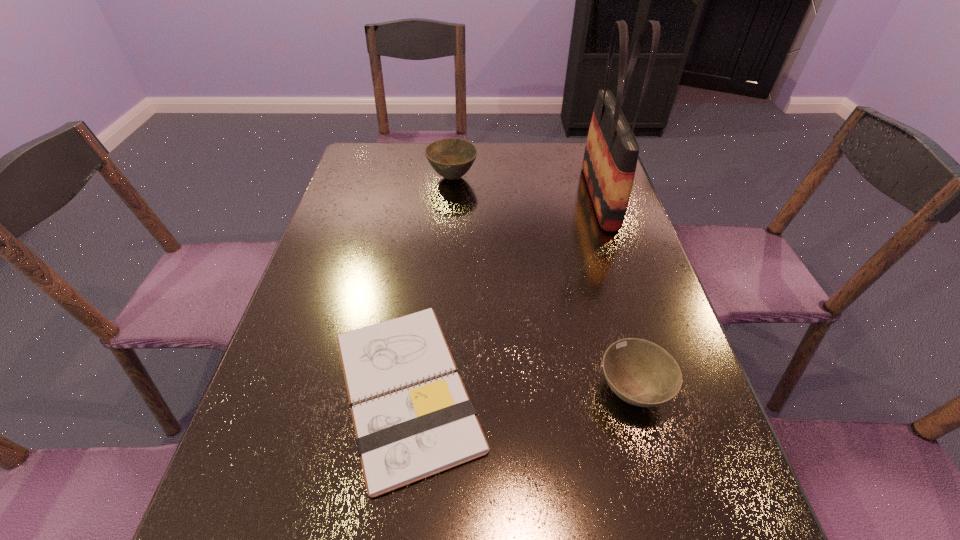
Find the location of a particular element. unoccupied position between the farther bowl and the notepad is located at coordinates (429, 284).

I want to click on vacant area between the shortest object and the shopping bag, so click(x=503, y=293).

You are a GUI agent. You are given a task and a screenshot of the screen. Output one action in this format:
    pyautogui.click(x=<x>, y=<y>)
    Task: Click on the object that is the second closest to the nearer bowl
    
    Given the screenshot: What is the action you would take?
    pyautogui.click(x=611, y=153)

You are a GUI agent. You are given a task and a screenshot of the screen. Output one action in this format:
    pyautogui.click(x=<x>, y=<y>)
    Task: Click on the object that is the second closest to the left bowl
    This screenshot has width=960, height=540.
    Given the screenshot: What is the action you would take?
    pyautogui.click(x=406, y=436)

Locate an element on the screen. The width and height of the screenshot is (960, 540). free location that satisfies the following two spatial constraints: 1. on the back side of the shortest object; 2. on the left side of the farther bowl is located at coordinates (435, 178).

Where is `vacant position in the image that satisfies the following two spatial constraints: 1. on the front-facing side of the tallest object; 2. on the front side of the third tallest object`? The image size is (960, 540). vacant position in the image that satisfies the following two spatial constraints: 1. on the front-facing side of the tallest object; 2. on the front side of the third tallest object is located at coordinates (664, 390).

Where is `vacant position in the image that satisfies the following two spatial constraints: 1. on the front side of the second tallest object; 2. on the right side of the nearer bowl`? The width and height of the screenshot is (960, 540). vacant position in the image that satisfies the following two spatial constraints: 1. on the front side of the second tallest object; 2. on the right side of the nearer bowl is located at coordinates (435, 390).